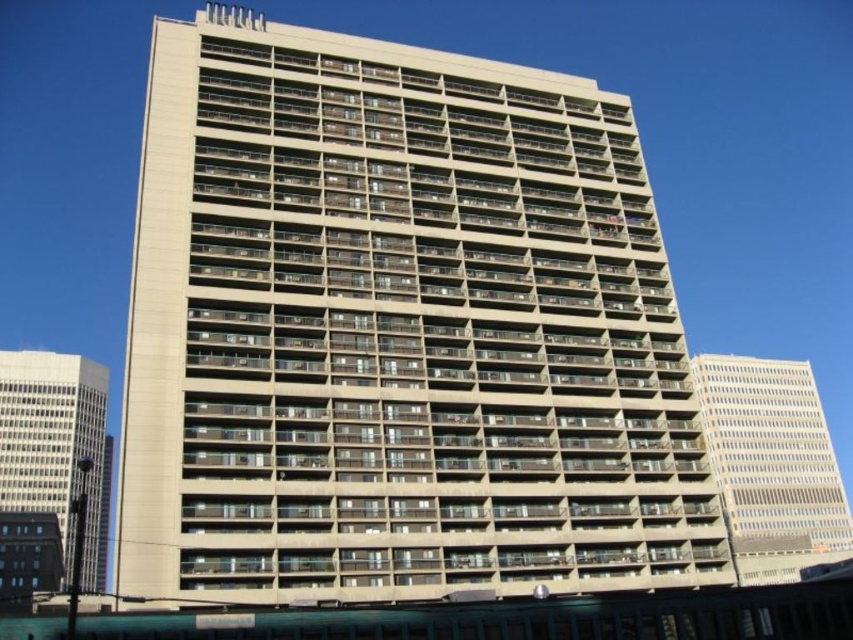
From the picture: Can you confirm if white concrete building at right is positioned to the right of beige concrete building at left?

Yes, white concrete building at right is to the right of beige concrete building at left.

The width and height of the screenshot is (853, 640). I want to click on white concrete building at right, so click(770, 465).

Does point (753, 435) lie in front of point (1, 467)?

No, (753, 435) is further to viewer.

The image size is (853, 640). Find the location of `white concrete building at right`. white concrete building at right is located at coordinates (770, 465).

Who is positioned more to the right, beige concrete building at center or white concrete building at right?

white concrete building at right

Can you confirm if beige concrete building at center is thinner than white concrete building at right?

Yes.

Identify the location of beige concrete building at center. (397, 332).

Find the location of a particular element. The width and height of the screenshot is (853, 640). beige concrete building at center is located at coordinates (397, 332).

Does point (332, 148) come in front of point (38, 460)?

Yes, it is.

What do you see at coordinates (397, 332) in the screenshot? This screenshot has height=640, width=853. I see `beige concrete building at center` at bounding box center [397, 332].

Image resolution: width=853 pixels, height=640 pixels. What are the coordinates of `beige concrete building at center` in the screenshot? It's located at (397, 332).